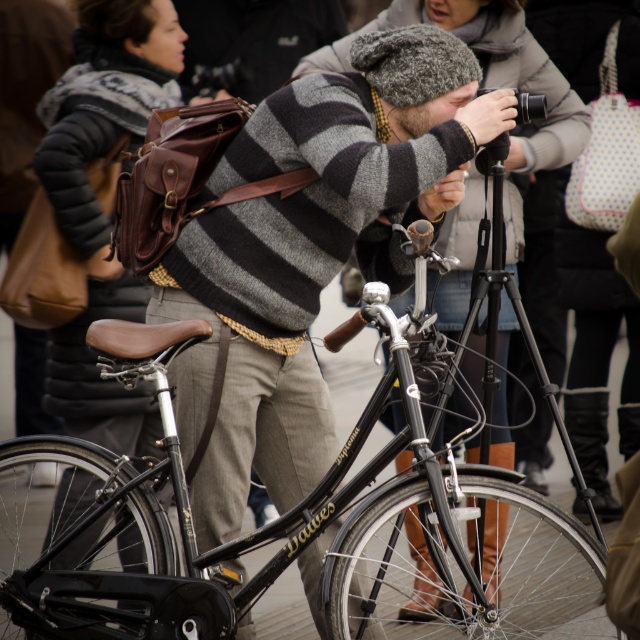
Question: Estimate the real-world distances between objects in this image. Which object is farther from the striped wool sweater at center?

Choices:
 (A) gray striped sweater at center
 (B) matte gray sweater at center

Answer: (A)

Question: Where is matte gray sweater at center located in relation to gray striped sweater at center in the image?

Choices:
 (A) left
 (B) right

Answer: (B)

Question: Can you confirm if shiny black bicycle at center is positioned to the left of striped wool sweater at center?

Choices:
 (A) no
 (B) yes

Answer: (A)

Question: Considering the real-world distances, which object is farthest from the gray striped sweater at center?

Choices:
 (A) striped wool sweater at center
 (B) shiny black bicycle at center

Answer: (B)

Question: Which is nearer to the striped wool sweater at center?

Choices:
 (A) matte gray sweater at center
 (B) gray striped sweater at center

Answer: (A)

Question: Is matte gray sweater at center bigger than gray striped sweater at center?

Choices:
 (A) no
 (B) yes

Answer: (B)